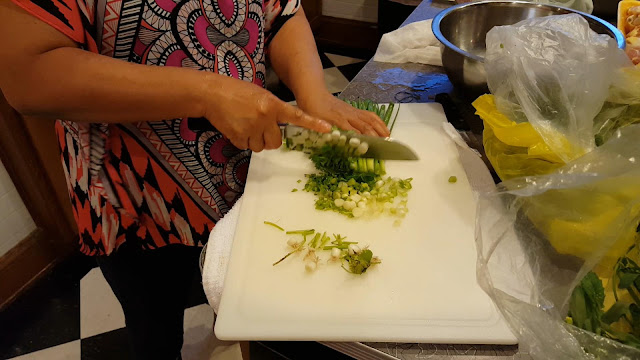
Where is `dark brown table`? dark brown table is located at coordinates (394, 89).